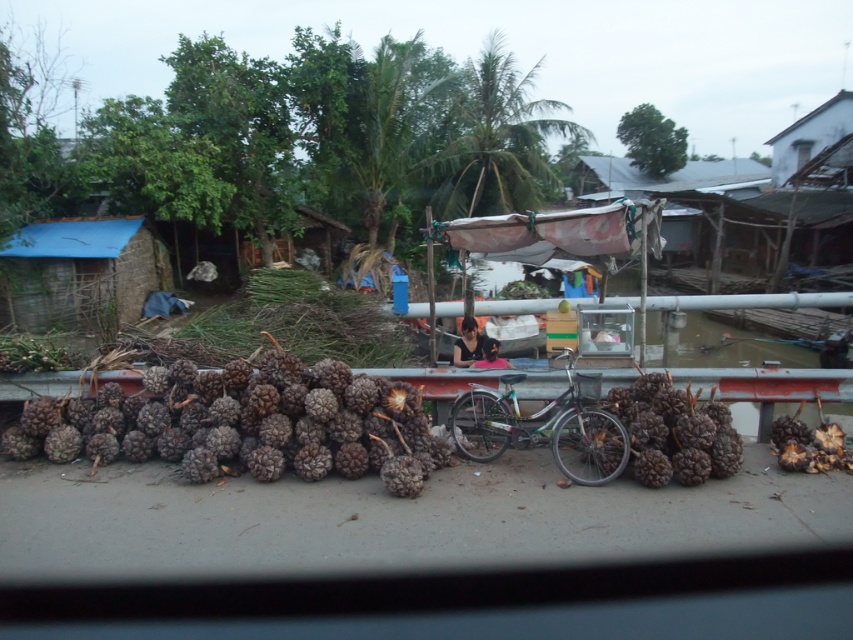
Question: Which point is closer to the camera taking this photo?

Choices:
 (A) (653, 461)
 (B) (9, 304)
 (C) (155, 404)
 (D) (582, 410)

Answer: (A)

Question: Which of these objects is positioned closest to the brown rough pine cone at right?

Choices:
 (A) blue tarp at left
 (B) metallic silver bicycle at center
 (C) brown rough pinecones at center
 (D) brown rough pinecones at right

Answer: (D)

Question: Is brown rough pinecones at center closer to camera compared to brown rough pine cone at right?

Choices:
 (A) yes
 (B) no

Answer: (A)

Question: From the image, what is the correct spatial relationship of brown rough pinecones at center in relation to metallic silver bicycle at center?

Choices:
 (A) above
 (B) below

Answer: (B)

Question: Which of the following is the closest to the observer?

Choices:
 (A) metallic silver bicycle at center
 (B) brown rough pinecones at center
 (C) brown rough pine cone at right
 (D) blue tarp at left

Answer: (B)

Question: Does metallic silver bicycle at center appear on the right side of brown rough pine cone at right?

Choices:
 (A) yes
 (B) no

Answer: (B)